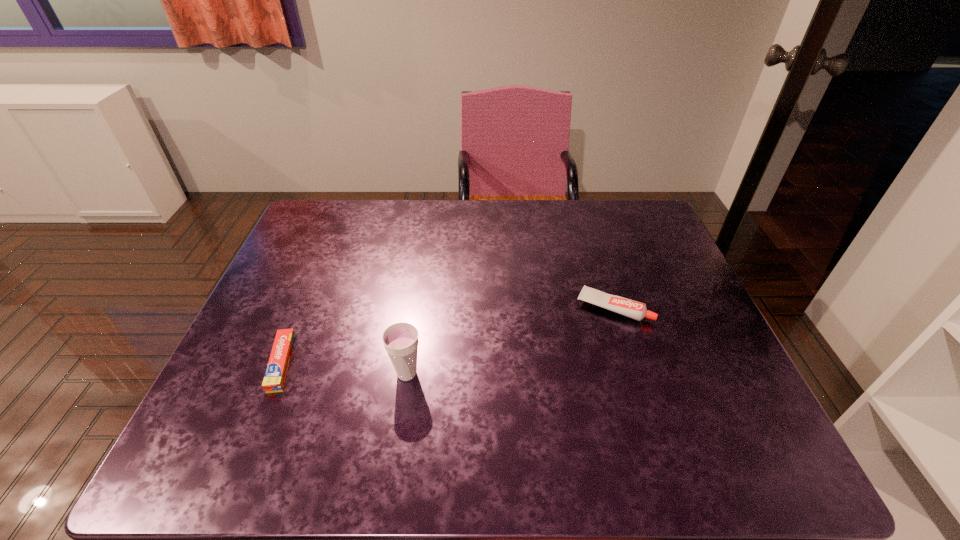
Find the location of a particular element. This screenshot has width=960, height=540. object that is at the right edge is located at coordinates (630, 308).

Image resolution: width=960 pixels, height=540 pixels. In the image, there is a desktop. In order to click on vacant space at the far edge in this screenshot , I will do `click(446, 201)`.

Where is `free space at the right edge of the desktop`? free space at the right edge of the desktop is located at coordinates (634, 294).

In the image, there is a desktop. Where is `vacant space at the near left corner`? Image resolution: width=960 pixels, height=540 pixels. vacant space at the near left corner is located at coordinates (254, 468).

Where is `free location at the far right corner of the desktop`? free location at the far right corner of the desktop is located at coordinates (637, 221).

This screenshot has height=540, width=960. In the image, there is a desktop. What are the coordinates of `vacant region at the near right corner` in the screenshot? It's located at (778, 472).

Find the location of `free space between the rightmost object and the left toothpaste`. free space between the rightmost object and the left toothpaste is located at coordinates (447, 335).

Identify the location of free space that is in between the cup and the second shortest object. (511, 340).

Where is `free space between the shorter toothpaste and the farthest object`? This screenshot has width=960, height=540. free space between the shorter toothpaste and the farthest object is located at coordinates (447, 335).

In order to click on free space between the shortest object and the second object from right to left in this screenshot , I will do click(x=345, y=368).